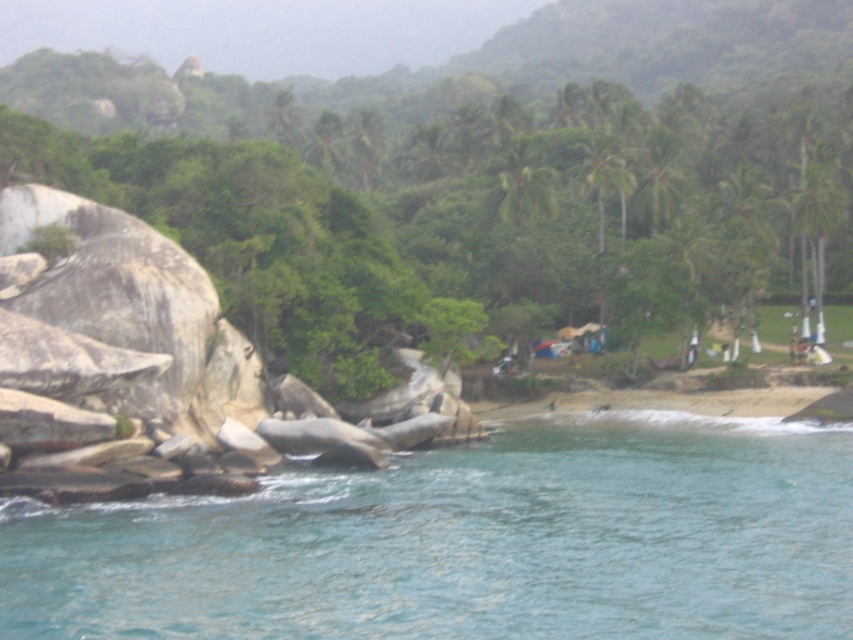
How distant is clear blue water at lower left from green leafy palm tree at upper center?

clear blue water at lower left and green leafy palm tree at upper center are 48.76 meters apart.

Is clear blue water at lower left bigger than green leafy palm tree at upper center?

Incorrect, clear blue water at lower left is not larger than green leafy palm tree at upper center.

Is point (0, 632) positioned in front of point (508, 196)?

Yes, point (0, 632) is closer to viewer.

Identify the location of clear blue water at lower left. The image size is (853, 640). [469, 541].

Is clear blue water at lower left wider than green leafy palm tree at upper right?

Yes, clear blue water at lower left is wider than green leafy palm tree at upper right.

Between clear blue water at lower left and green leafy palm tree at upper right, which one has less height?

With less height is clear blue water at lower left.

Which is behind, point (680, 570) or point (810, 163)?

The point (810, 163) is behind.

This screenshot has width=853, height=640. I want to click on clear blue water at lower left, so click(469, 541).

Which is above, green leafy palm tree at upper right or green leafy palm tree at upper center?

green leafy palm tree at upper center is above.

Is green leafy palm tree at upper right bigger than green leafy palm tree at upper center?

Indeed, green leafy palm tree at upper right has a larger size compared to green leafy palm tree at upper center.

Who is more distant from viewer, (843, 214) or (512, 156)?

Point (512, 156)

Where is `green leafy palm tree at upper right`? green leafy palm tree at upper right is located at coordinates (814, 230).